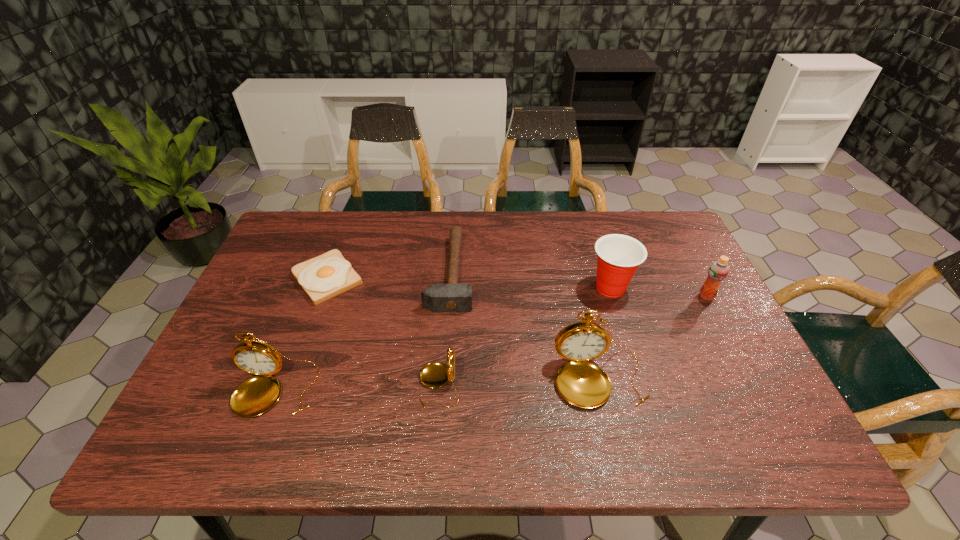
The image size is (960, 540). What are the coordinates of `unoccupied position between the rightmost object and the rightmost pocket watch` in the screenshot? It's located at (653, 338).

The width and height of the screenshot is (960, 540). Find the location of `empty space between the fifth tallest object and the hammer`. empty space between the fifth tallest object and the hammer is located at coordinates (444, 328).

In order to click on unoccupied position between the rightmost pocket watch and the shortest object in this screenshot , I will do `click(464, 328)`.

Where is `free spot between the shortest object and the second pocket watch from right to left`? The width and height of the screenshot is (960, 540). free spot between the shortest object and the second pocket watch from right to left is located at coordinates (383, 332).

Where is `free space between the leftmost pocket watch and the toast`? This screenshot has height=540, width=960. free space between the leftmost pocket watch and the toast is located at coordinates (301, 334).

You are a GUI agent. You are given a task and a screenshot of the screen. Output one action in this format:
    pyautogui.click(x=<x>, y=<y>)
    Task: Click on the object that is the third nearest to the fifth tallest object
    This screenshot has height=540, width=960.
    Given the screenshot: What is the action you would take?
    pyautogui.click(x=256, y=395)

Locate which object ranks fifth in proximity to the cup. Please provide its 2D coordinates. Your answer should be formatted as a tuple, i.e. [(x, y)], where the tuple contains the x and y coordinates of a point satisfying the conditions above.

[(328, 275)]

The image size is (960, 540). I want to click on pocket watch that is the closest to the cup, so click(583, 384).

Where is `the closest pocket watch to the shortest pocket watch`? This screenshot has height=540, width=960. the closest pocket watch to the shortest pocket watch is located at coordinates (583, 384).

The height and width of the screenshot is (540, 960). Find the location of `free location that satisfies the following two spatial constraints: 1. on the striking surface of the hammer; 2. on the back side of the rightmost object`. free location that satisfies the following two spatial constraints: 1. on the striking surface of the hammer; 2. on the back side of the rightmost object is located at coordinates (448, 296).